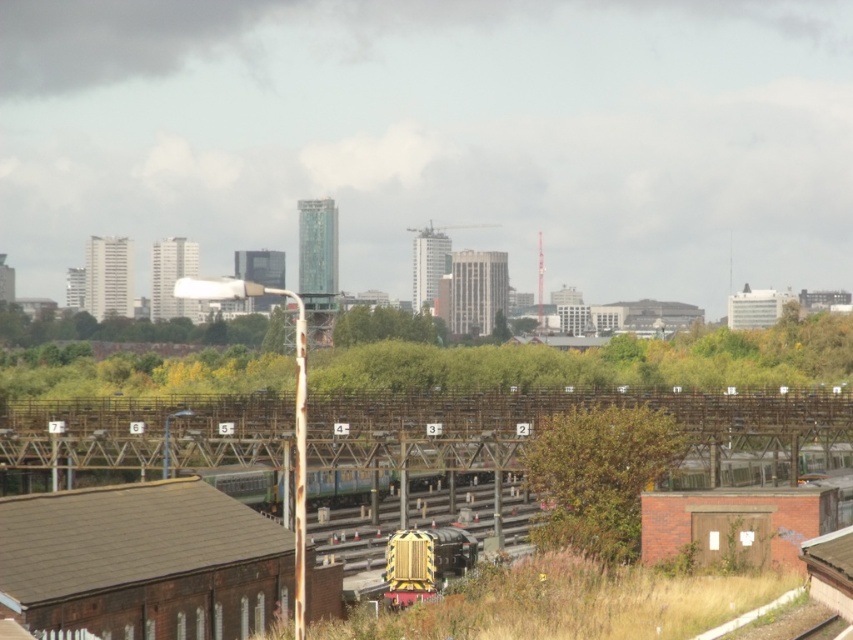
Question: Does brown textured bush at center have a lesser width compared to yellow matte train at center?

Choices:
 (A) no
 (B) yes

Answer: (A)

Question: Which point appears closest to the camera in this image?

Choices:
 (A) (648, 460)
 (B) (427, 568)

Answer: (A)

Question: Considering the relative positions of brown textured bush at center and yellow matte train at center in the image provided, where is brown textured bush at center located with respect to yellow matte train at center?

Choices:
 (A) below
 (B) above

Answer: (B)

Question: Can you confirm if brown textured bush at center is thinner than yellow matte train at center?

Choices:
 (A) yes
 (B) no

Answer: (B)